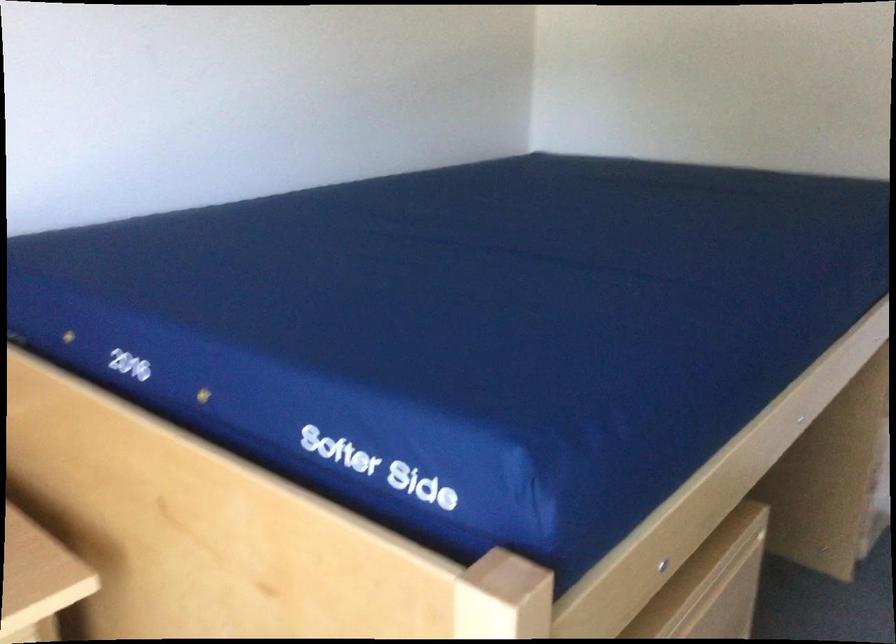
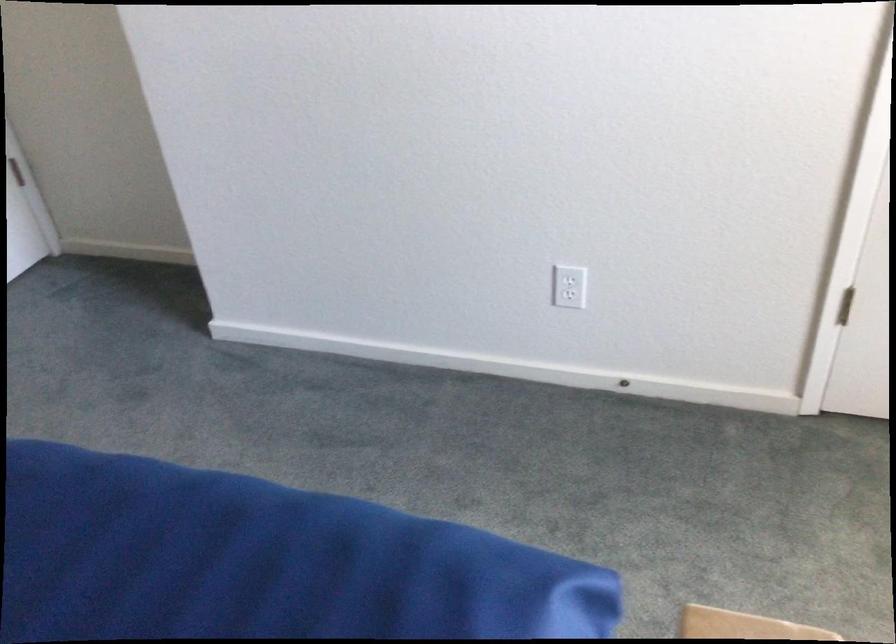
How did the camera likely rotate?

The rotation direction of the camera is right-down.